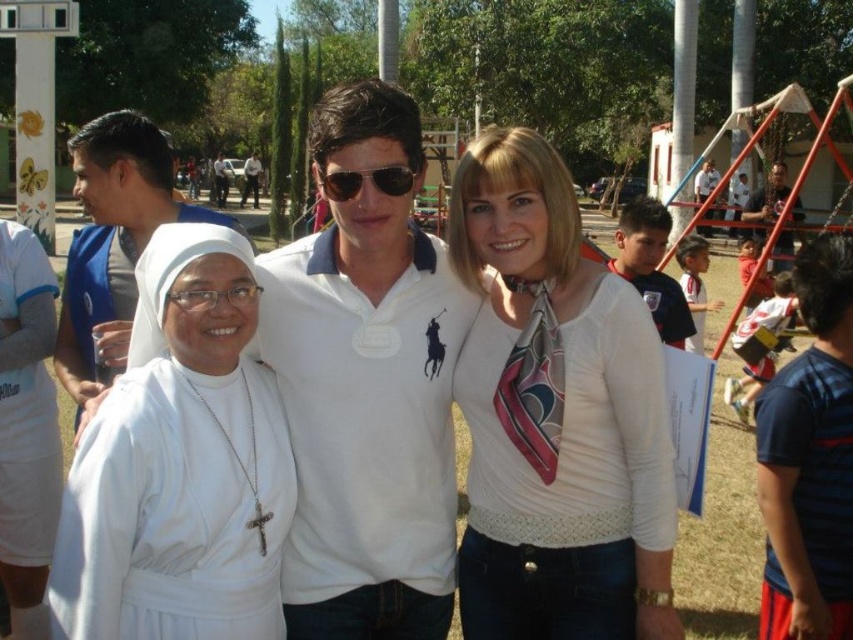
Who is lower down, white cloth at left or blue striped shirt at right?

blue striped shirt at right is below.

What do you see at coordinates (178, 472) in the screenshot? The image size is (853, 640). I see `white cloth at left` at bounding box center [178, 472].

Between point (77, 604) and point (801, 534), which one is positioned behind?

The point (801, 534) is more distant.

The height and width of the screenshot is (640, 853). I want to click on white cloth at left, so click(178, 472).

Who is more forward, (746, 387) or (344, 179)?

Positioned in front is point (344, 179).

Does striped cotton shirt at right appear on the left side of sunglasses at center?

No, striped cotton shirt at right is not to the left of sunglasses at center.

The width and height of the screenshot is (853, 640). Describe the element at coordinates (759, 344) in the screenshot. I see `striped cotton shirt at right` at that location.

Where is `striped cotton shirt at right`? Image resolution: width=853 pixels, height=640 pixels. striped cotton shirt at right is located at coordinates (759, 344).

Which is more to the right, white cotton polo shirt at center or white cotton shirt at center?

white cotton polo shirt at center

Does white cotton polo shirt at center have a greater height compared to white cotton shirt at center?

In fact, white cotton polo shirt at center may be shorter than white cotton shirt at center.

The image size is (853, 640). I want to click on white cotton polo shirt at center, so click(367, 388).

Find the location of a particular element. This screenshot has height=640, width=853. white cotton polo shirt at center is located at coordinates (367, 388).